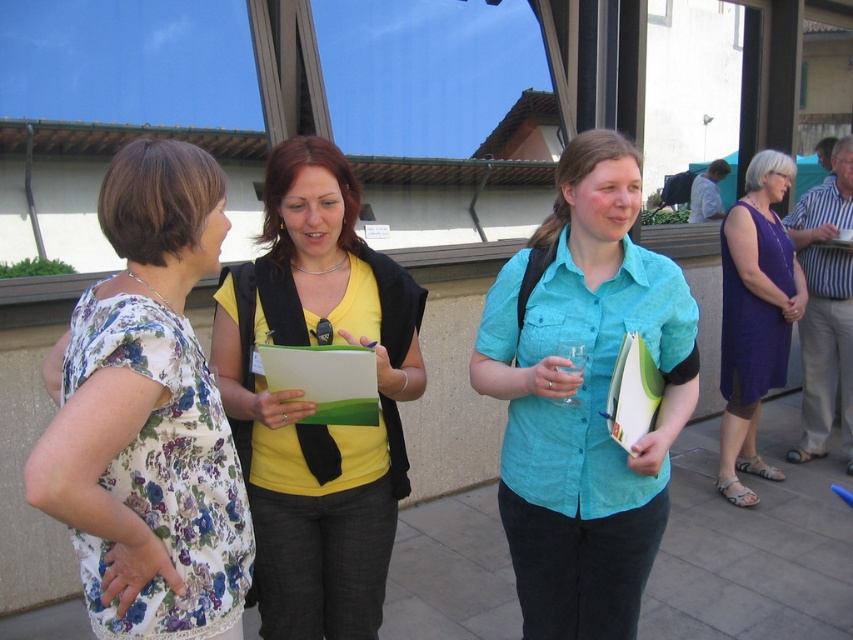
Question: Which point is farther from the camera taking this photo?

Choices:
 (A) (358, 394)
 (B) (164, 456)
 (C) (312, 580)
 (D) (654, 492)

Answer: (C)

Question: Is teal cotton shirt at center bigger than green matte clipboard at center?

Choices:
 (A) no
 (B) yes

Answer: (B)

Question: Considering the real-world distances, which object is closest to the yellow matte shirt at center?

Choices:
 (A) green matte clipboard at center
 (B) purple satin dress at right
 (C) floral fabric dress at left
 (D) teal cotton shirt at center

Answer: (A)

Question: Does purple satin dress at right appear on the right side of green matte clipboard at center?

Choices:
 (A) yes
 (B) no

Answer: (A)

Question: Is yellow matte shirt at center above green matte clipboard at center?

Choices:
 (A) no
 (B) yes

Answer: (A)

Question: Considering the real-world distances, which object is closest to the purple satin dress at right?

Choices:
 (A) green matte clipboard at center
 (B) yellow matte shirt at center
 (C) floral fabric dress at left

Answer: (B)